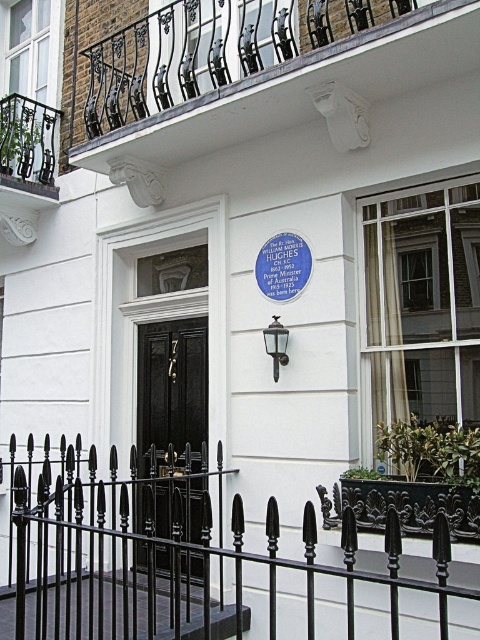
Looking at this image, who is positioned more to the left, white wrought iron balcony at upper center or black polished wood door at center?

black polished wood door at center

Is white wrought iron balcony at upper center bigger than black polished wood door at center?

Yes.

The width and height of the screenshot is (480, 640). What do you see at coordinates (262, 81) in the screenshot?
I see `white wrought iron balcony at upper center` at bounding box center [262, 81].

Find the location of a particular element. Image resolution: width=480 pixels, height=640 pixels. white wrought iron balcony at upper center is located at coordinates (262, 81).

Can you confirm if black polished wood door at center is positioned to the right of bluematerial/textureplaque at center?

Incorrect, black polished wood door at center is not on the right side of bluematerial/textureplaque at center.

Where is `black polished wood door at center`? The height and width of the screenshot is (640, 480). black polished wood door at center is located at coordinates (171, 397).

The image size is (480, 640). Find the location of `black polished wood door at center`. black polished wood door at center is located at coordinates (171, 397).

Does black wrought iron fence at lower center come in front of black polished wood door at center?

Yes, black wrought iron fence at lower center is in front of black polished wood door at center.

Consider the image. Can you confirm if black wrought iron fence at lower center is shorter than black polished wood door at center?

Correct, black wrought iron fence at lower center is not as tall as black polished wood door at center.

Is point (176, 477) positioned before point (145, 451)?

Yes, point (176, 477) is closer to viewer.

Identify the location of black wrought iron fence at lower center. (168, 554).